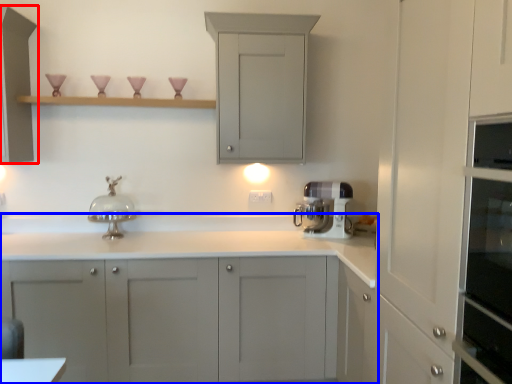
Question: Which object is closer to the camera taking this photo, cabinetry (highlighted by a red box) or cabinetry (highlighted by a blue box)?

Choices:
 (A) cabinetry
 (B) cabinetry

Answer: (B)